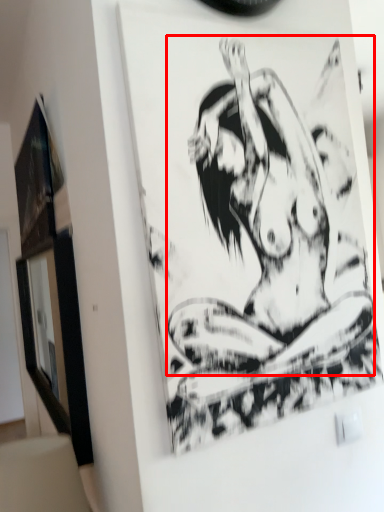
Question: From the image's perspective, what is the correct spatial relationship of person (annotated by the red box) in relation to picture frame?

Choices:
 (A) above
 (B) below

Answer: (B)